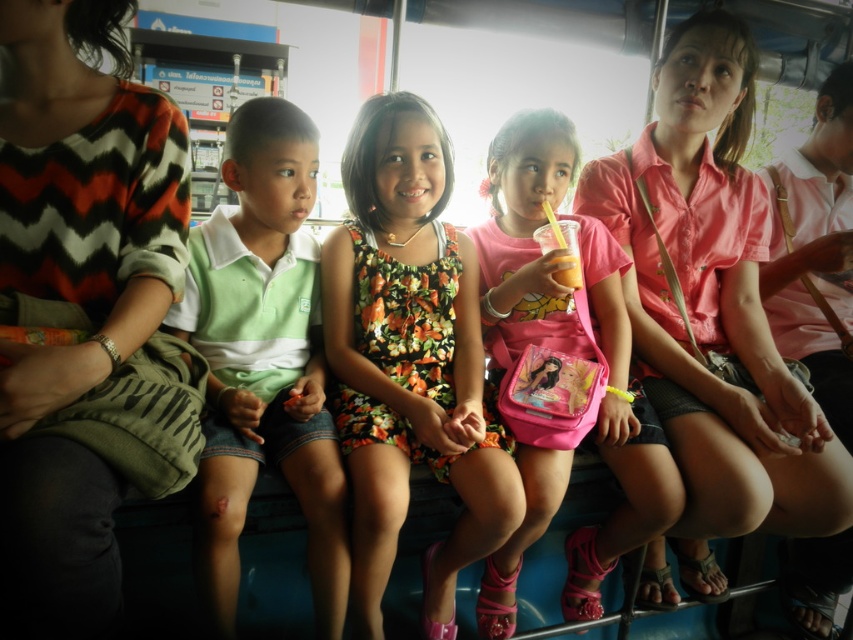
Question: Which of the following is the farthest from the observer?

Choices:
 (A) floral dress at center
 (B) pink fabric bag at center

Answer: (B)

Question: Estimate the real-world distances between objects in this image. Which object is closer to the floral dress at center?

Choices:
 (A) green cotton shirt at left
 (B) pink fabric bag at center

Answer: (A)

Question: Is floral dress at center positioned in front of green cotton shirt at left?

Choices:
 (A) yes
 (B) no

Answer: (B)

Question: Which point appears closest to the camera in this image?

Choices:
 (A) (492, 176)
 (B) (474, 316)
 (C) (332, 632)

Answer: (C)

Question: Considering the relative positions of floral dress at center and pink fabric bag at center in the image provided, where is floral dress at center located with respect to pink fabric bag at center?

Choices:
 (A) above
 (B) below

Answer: (A)

Question: Can you confirm if floral dress at center is positioned to the right of pink fabric bag at center?

Choices:
 (A) no
 (B) yes

Answer: (A)